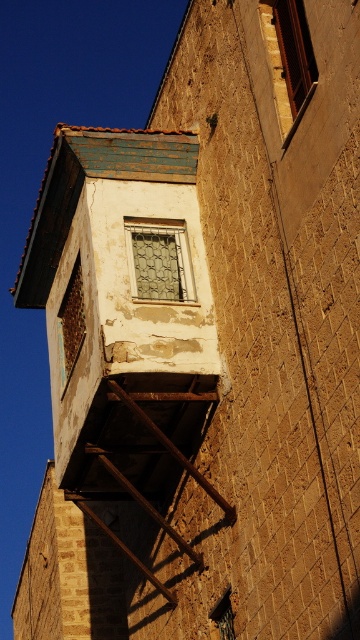
Between point (261, 24) and point (164, 288), which one is positioned in front?

Point (261, 24) is in front.

Does wooden frame at upper right appear over metallic mesh window at center?

Indeed, wooden frame at upper right is positioned over metallic mesh window at center.

Does point (299, 35) come behind point (129, 220)?

No, it is in front of (129, 220).

Locate an element on the screen. Image resolution: width=360 pixels, height=640 pixels. wooden frame at upper right is located at coordinates (289, 60).

This screenshot has height=640, width=360. What are the coordinates of `wooden frame at upper right` in the screenshot? It's located at (289, 60).

Who is shorter, wooden frame at upper right or rusty metal window at center?

rusty metal window at center is shorter.

Does point (286, 56) come closer to viewer compared to point (62, 365)?

Yes, point (286, 56) is in front of point (62, 365).

Where is `wooden frame at upper right`? The width and height of the screenshot is (360, 640). wooden frame at upper right is located at coordinates [289, 60].

Which of these two, rusty metal fire escape at lower center or metallic mesh window at center, stands shorter?

With less height is metallic mesh window at center.

Which is behind, point (200, 401) or point (164, 282)?

Positioned behind is point (164, 282).

Locate an element on the screen. This screenshot has height=640, width=360. rusty metal fire escape at lower center is located at coordinates (144, 444).